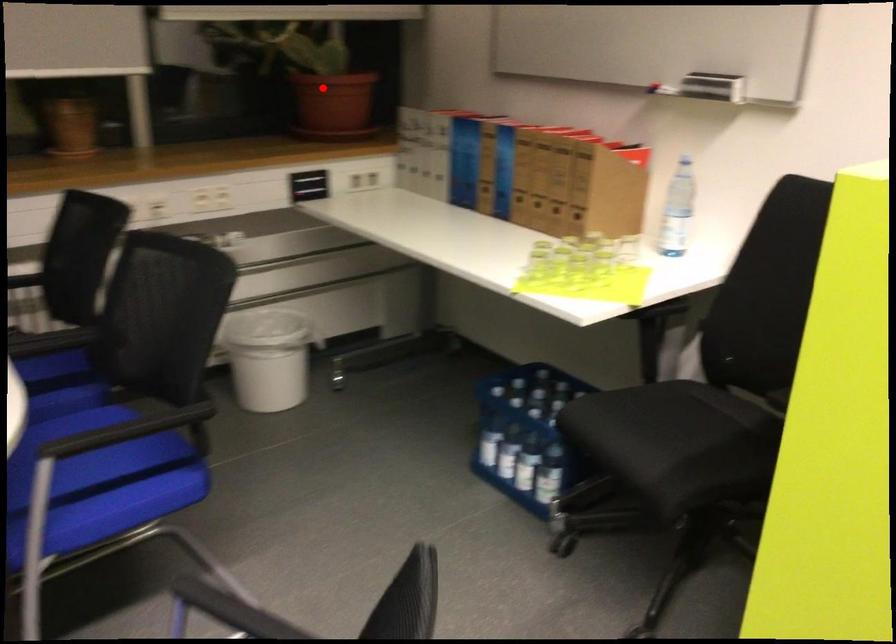
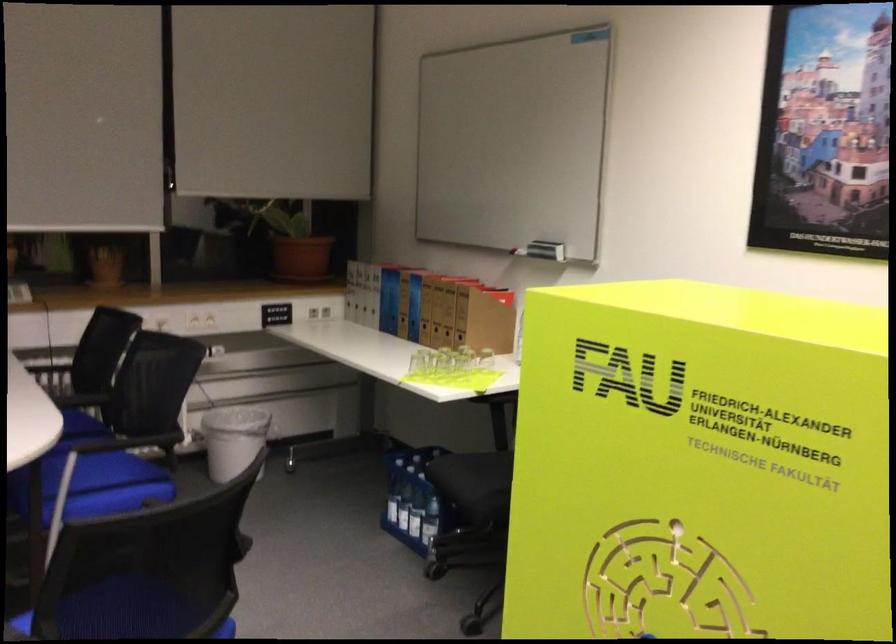
Locate, in the second image, the point that corresponds to the highlighted location in the first image.

(294, 243)